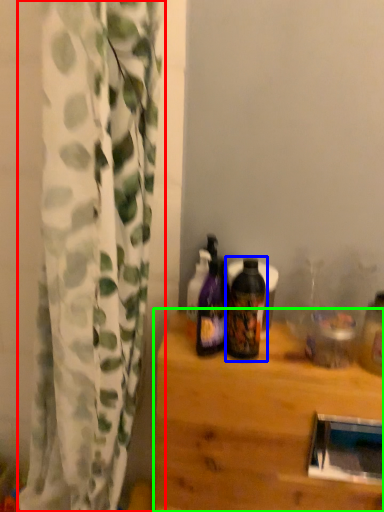
Question: Based on their relative distances, which object is nearer to curtain (highlighted by a red box)? Choose from bottle (highlighted by a blue box) and table (highlighted by a green box).

Choices:
 (A) bottle
 (B) table

Answer: (B)